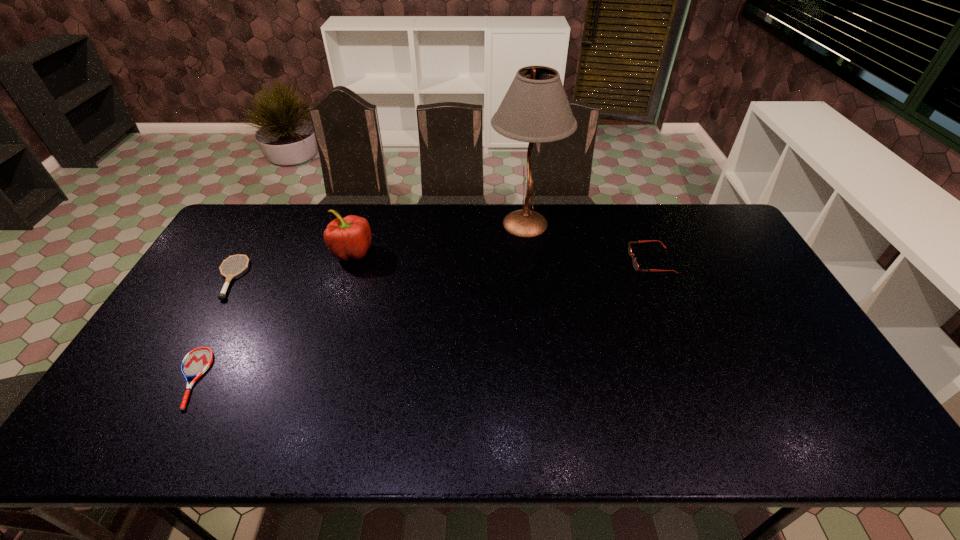
Identify the location of the second object from right to left. Image resolution: width=960 pixels, height=540 pixels. (535, 109).

The height and width of the screenshot is (540, 960). Find the location of `table lamp`. table lamp is located at coordinates (535, 109).

Locate an element on the screen. The width and height of the screenshot is (960, 540). bell pepper is located at coordinates (347, 238).

At what (x,y) coordinates should I click in order to perform the action: click on the second tallest object. Please return your answer as a coordinate pair (x, y). The height and width of the screenshot is (540, 960). Looking at the image, I should click on (347, 238).

At what (x,y) coordinates should I click in order to perform the action: click on the third tallest object. Please return your answer as a coordinate pair (x, y). Looking at the image, I should click on (635, 264).

I want to click on spectacles, so click(635, 264).

What are the coordinates of `the taller tennis racket` in the screenshot? It's located at (221, 296).

Identify the location of the fourth tallest object. (221, 296).

Find the location of a particular element. The width and height of the screenshot is (960, 540). the shorter tennis racket is located at coordinates (196, 362).

You are a GUI agent. You are given a task and a screenshot of the screen. Output one action in this format:
    pyautogui.click(x=<x>, y=<y>)
    Task: Click on the nearest object
    The width and height of the screenshot is (960, 540).
    Given the screenshot: What is the action you would take?
    pyautogui.click(x=196, y=362)